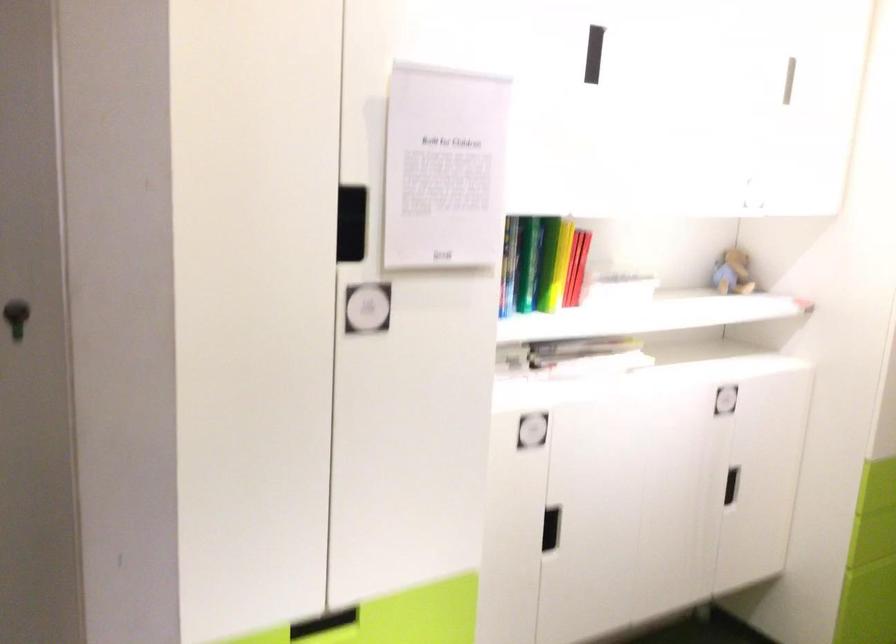
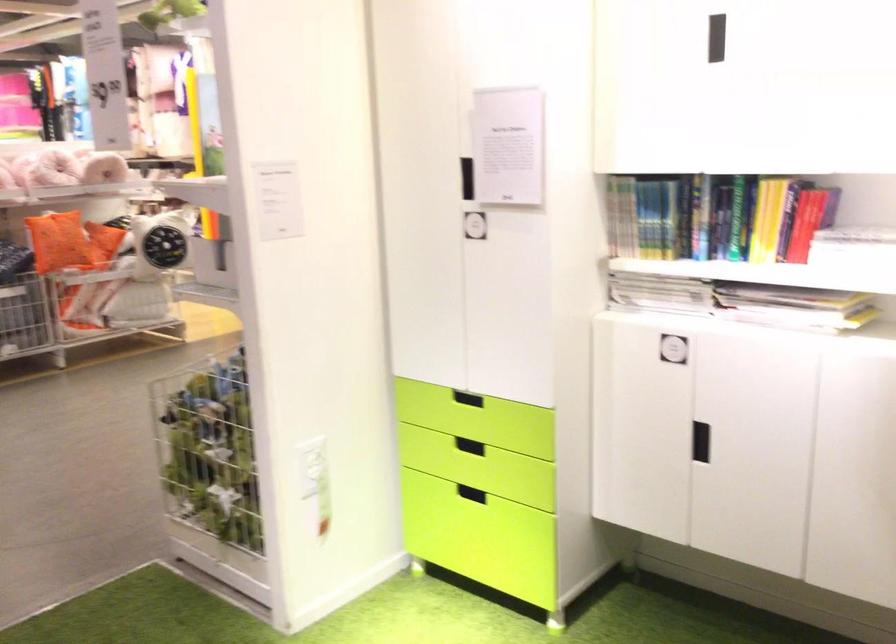
Locate, in the second image, the point that corresponds to (x=510, y=270) in the first image.

(717, 216)